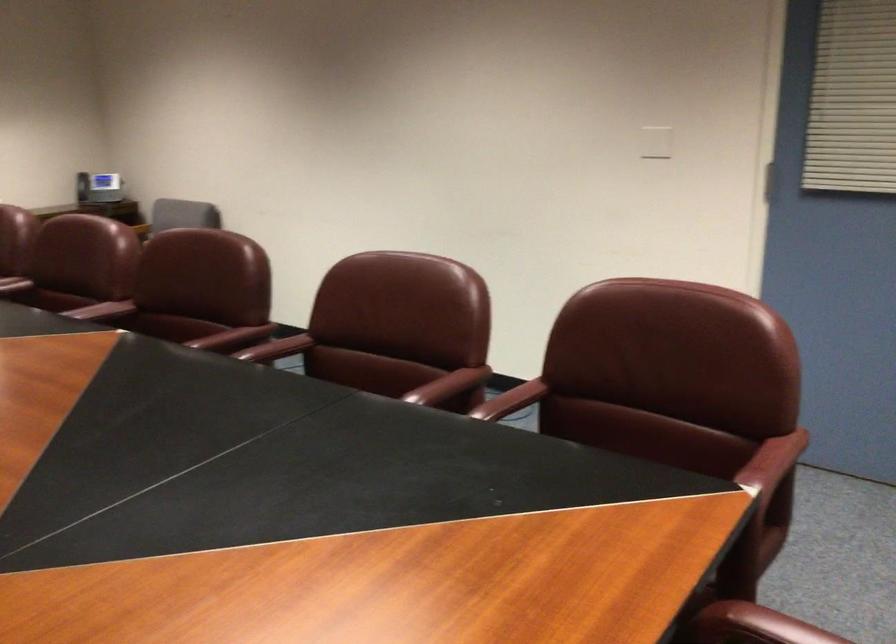
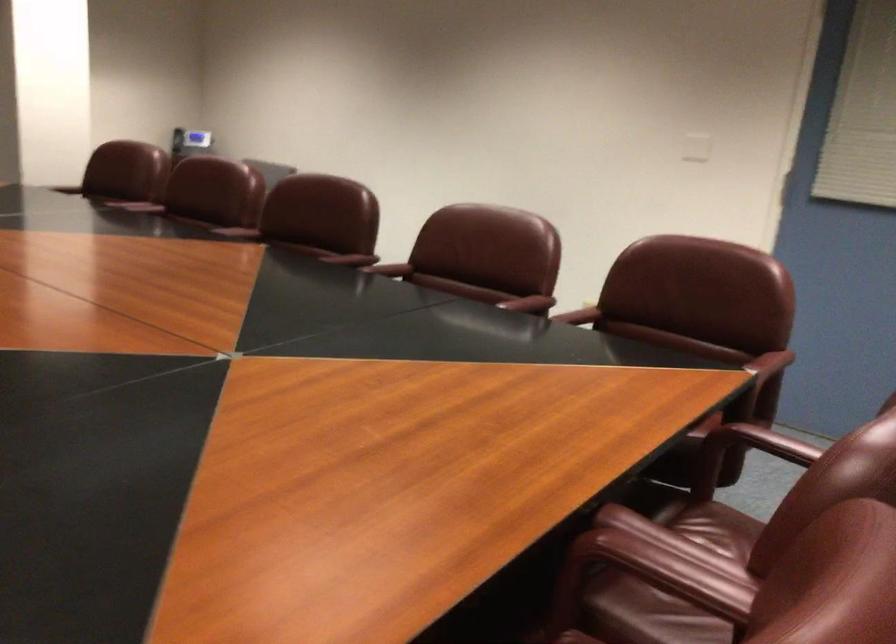
Where in the second image is the point corresponding to point 647,147 from the first image?

(695, 147)